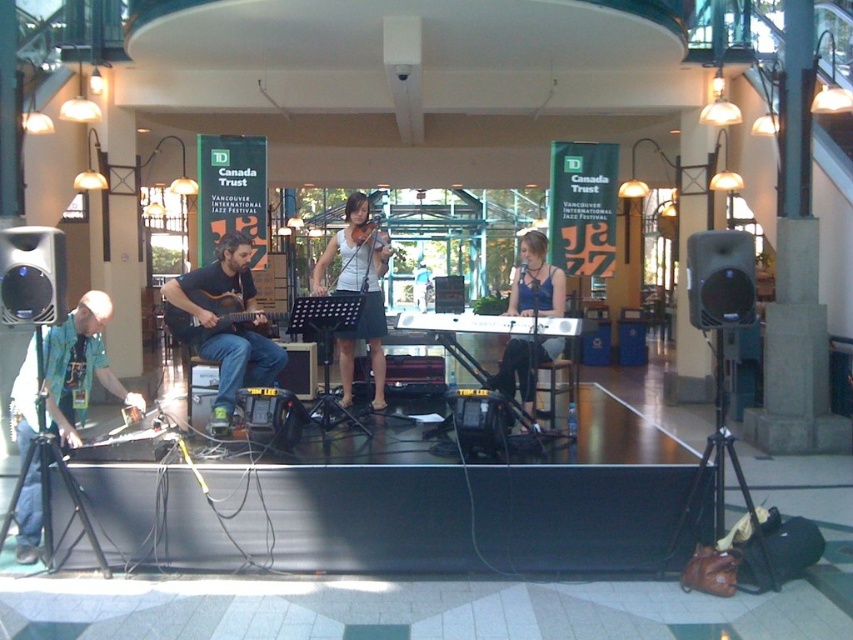
Question: Does white fabric skirt at center have a greater width compared to blue fabric dress at center?

Choices:
 (A) no
 (B) yes

Answer: (A)

Question: Is green fabric shirt at left to the left of blue fabric dress at center from the viewer's perspective?

Choices:
 (A) no
 (B) yes

Answer: (B)

Question: Which of the following is the farthest from the observer?

Choices:
 (A) blue fabric dress at center
 (B) matte black guitar at left
 (C) green fabric shirt at left

Answer: (A)

Question: Based on their relative distances, which object is nearer to the white fabric skirt at center?

Choices:
 (A) green fabric shirt at left
 (B) matte black guitar at left
 (C) acoustic wood guitar at center
 (D) blue fabric dress at center

Answer: (B)

Question: Which of the following is the closest to the observer?

Choices:
 (A) matte black guitar at left
 (B) white fabric skirt at center

Answer: (A)

Question: Does matte black guitar at left come behind blue fabric dress at center?

Choices:
 (A) no
 (B) yes

Answer: (A)